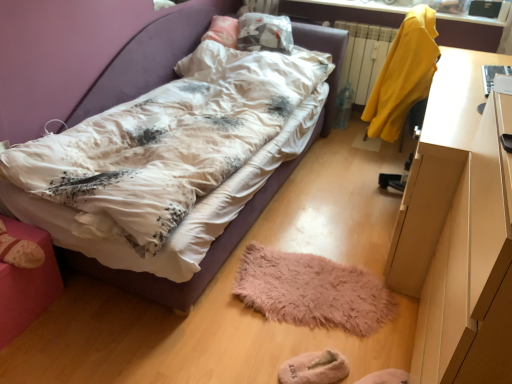
Locate an element on the screen. white glossy desk at right is located at coordinates (459, 230).

What do you see at coordinates (26, 284) in the screenshot? I see `pink fabric ottoman at lower left` at bounding box center [26, 284].

Describe the element at coordinates (312, 291) in the screenshot. I see `fuzzy pink mat at center` at that location.

Measure the distance between point [312,377] and camera.

Point [312,377] and camera are 4.89 feet apart.

You are a GUI agent. You are given a task and a screenshot of the screen. Output one action in this format:
    pyautogui.click(x=<x>, y=<y>)
    Task: Click on the white glossy desk at right
    The image size is (512, 384).
    Given the screenshot: What is the action you would take?
    pyautogui.click(x=459, y=230)

From the image's perspective, is beige fuzzy slippers at lower center located beneath fuzzy pink mat at center?

Correct, beige fuzzy slippers at lower center appears lower than fuzzy pink mat at center in the image.

Between point (306, 362) and point (361, 284), which one is positioned behind?

The point (361, 284) is more distant.

Does beige fuzzy slippers at lower center come behind fuzzy pink mat at center?

No, beige fuzzy slippers at lower center is in front of fuzzy pink mat at center.

Which is behind, point (393, 66) or point (265, 269)?

The point (393, 66) is behind.

How distant is yellow fabric coat at upper right from fuzzy pink mat at center?

yellow fabric coat at upper right and fuzzy pink mat at center are 37.07 inches apart from each other.

Which of these two, yellow fabric coat at upper right or fuzzy pink mat at center, is thinner?

yellow fabric coat at upper right is thinner.

From the image's perspective, which is above, yellow fabric coat at upper right or fuzzy pink mat at center?

yellow fabric coat at upper right.

Is beige fuzzy slippers at lower center next to matte white bed at center and touching it?

No, beige fuzzy slippers at lower center is not with matte white bed at center.

Is beige fuzzy slippers at lower center bigger or smaller than matte white bed at center?

In the image, beige fuzzy slippers at lower center appears to be smaller than matte white bed at center.

Would you say beige fuzzy slippers at lower center contains matte white bed at center?

No.

Which object is more forward, beige fuzzy slippers at lower center or matte white bed at center?

Positioned in front is matte white bed at center.

Between yellow fabric coat at upper right and beige fuzzy slippers at lower center, which one is positioned behind?

yellow fabric coat at upper right is further from the camera.

From the image's perspective, who appears lower, yellow fabric coat at upper right or beige fuzzy slippers at lower center?

beige fuzzy slippers at lower center appears lower in the image.

Would you say yellow fabric coat at upper right is inside or outside beige fuzzy slippers at lower center?

yellow fabric coat at upper right is outside beige fuzzy slippers at lower center.

Which is closer to the camera, (362,276) or (382,75)?

The point (362,276) is closer.

Looking at this image, from the image's perspective, is fuzzy pink mat at center on top of yellow fabric coat at upper right?

No, from the image's perspective, fuzzy pink mat at center is not above yellow fabric coat at upper right.

Does fuzzy pink mat at center have a larger size compared to yellow fabric coat at upper right?

No.

Visually, is fuzzy pink mat at center positioned to the left or to the right of yellow fabric coat at upper right?

In the image, fuzzy pink mat at center appears on the left side of yellow fabric coat at upper right.

Is pink fabric ottoman at lower left in front of beige fuzzy slippers at lower center?

Yes, it is in front of beige fuzzy slippers at lower center.

Considering the relative sizes of pink fabric ottoman at lower left and beige fuzzy slippers at lower center in the image provided, is pink fabric ottoman at lower left smaller than beige fuzzy slippers at lower center?

Incorrect, pink fabric ottoman at lower left is not smaller in size than beige fuzzy slippers at lower center.

From the image's perspective, is pink fabric ottoman at lower left below beige fuzzy slippers at lower center?

Incorrect, from the image's perspective, pink fabric ottoman at lower left is higher than beige fuzzy slippers at lower center.

Considering the points (13, 332) and (287, 372), which point is behind, point (13, 332) or point (287, 372)?

The point (13, 332) is farther from the camera.

Between pink suede shoe at lower left and beige fuzzy slippers at lower center, which one appears on the right side from the viewer's perspective?

Positioned to the right is beige fuzzy slippers at lower center.

Which is less distant, [1,235] or [338,368]?

Point [1,235] appears to be farther away from the viewer than point [338,368].

Who is bigger, pink suede shoe at lower left or beige fuzzy slippers at lower center?

pink suede shoe at lower left is bigger.

Looking at this image, is pink suede shoe at lower left positioned far away from beige fuzzy slippers at lower center?

That's right, there is a large distance between pink suede shoe at lower left and beige fuzzy slippers at lower center.

Locate an element on the screen. This screenshot has height=384, width=512. footwear positioned vertically above the fuzzy pink mat at center (from a real-world perspective) is located at coordinates (314, 368).

Find the location of `material above the fuzzy pink mat at center (from the image's perspective)`. material above the fuzzy pink mat at center (from the image's perspective) is located at coordinates (403, 74).

Looking at the image, which one is located closer to fuzzy pink mat at center, matte white bed at center or yellow fabric coat at upper right?

yellow fabric coat at upper right.

Based on their spatial positions, is yellow fabric coat at upper right or fuzzy pink mat at center closer to beige fuzzy slippers at lower center?

Based on the image, fuzzy pink mat at center appears to be nearer to beige fuzzy slippers at lower center.

When comparing their distances from beige fuzzy slippers at lower center, does pink suede shoe at lower left or matte white bed at center seem further?

matte white bed at center is positioned further to the anchor beige fuzzy slippers at lower center.

From the image, which object appears to be nearer to pink suede shoe at lower left, matte white bed at center or fuzzy pink mat at center?

matte white bed at center is positioned closer to the anchor pink suede shoe at lower left.

Looking at the image, which one is located closer to pink fabric ottoman at lower left, beige fuzzy slippers at lower center or yellow fabric at upper right?

beige fuzzy slippers at lower center is closer to pink fabric ottoman at lower left.

Looking at the image, which one is located closer to yellow fabric coat at upper right, beige fuzzy slippers at lower center or white glossy desk at right?

white glossy desk at right lies closer to yellow fabric coat at upper right than the other object.

Consider the image. Which object lies nearer to the anchor point pink fabric ottoman at lower left, beige fuzzy slippers at lower center or pink suede shoe at lower left?

The object closer to pink fabric ottoman at lower left is pink suede shoe at lower left.

When comparing their distances from yellow fabric coat at upper right, does pink fabric ottoman at lower left or pink suede shoe at lower left seem further?

pink suede shoe at lower left is further to yellow fabric coat at upper right.

Locate an element on the screen. This screenshot has height=384, width=512. bed between white glossy desk at right and yellow fabric at upper right from front to back is located at coordinates (239, 213).

Where is `footwear between pink suede shoe at lower left and fuzzy pink mat at center from left to right`? Image resolution: width=512 pixels, height=384 pixels. footwear between pink suede shoe at lower left and fuzzy pink mat at center from left to right is located at coordinates (314, 368).

Image resolution: width=512 pixels, height=384 pixels. Identify the location of shoe between white glossy desk at right and yellow fabric at upper right from front to back. (19, 250).

In order to click on mat between pink fabric ottoman at lower left and yellow fabric coat at upper right in this screenshot , I will do `click(312, 291)`.